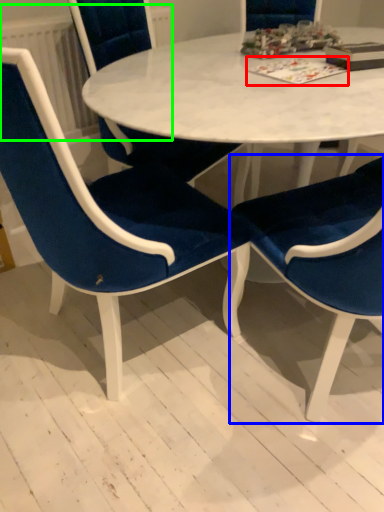
Question: Which object is the farthest from book (highlighted by a red box)? Choose among these: chair (highlighted by a blue box) or radiator (highlighted by a green box).

Choices:
 (A) chair
 (B) radiator

Answer: (B)